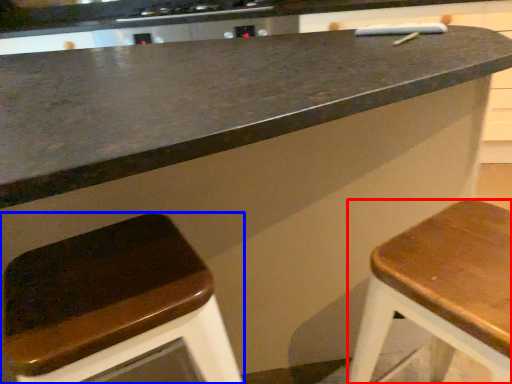
Question: Among these objects, which one is farthest to the camera, stool (highlighted by a red box) or stool (highlighted by a blue box)?

Choices:
 (A) stool
 (B) stool

Answer: (B)